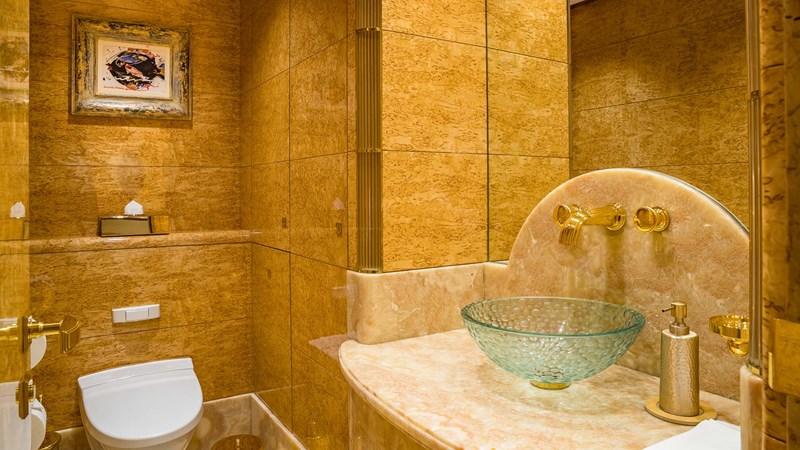
You are a GUI agent. You are given a task and a screenshot of the screen. Output one action in this format:
    pyautogui.click(x=<x>, y=<y>)
    Task: Click on the flush button
    
    Given the screenshot: What is the action you would take?
    pyautogui.click(x=140, y=310)